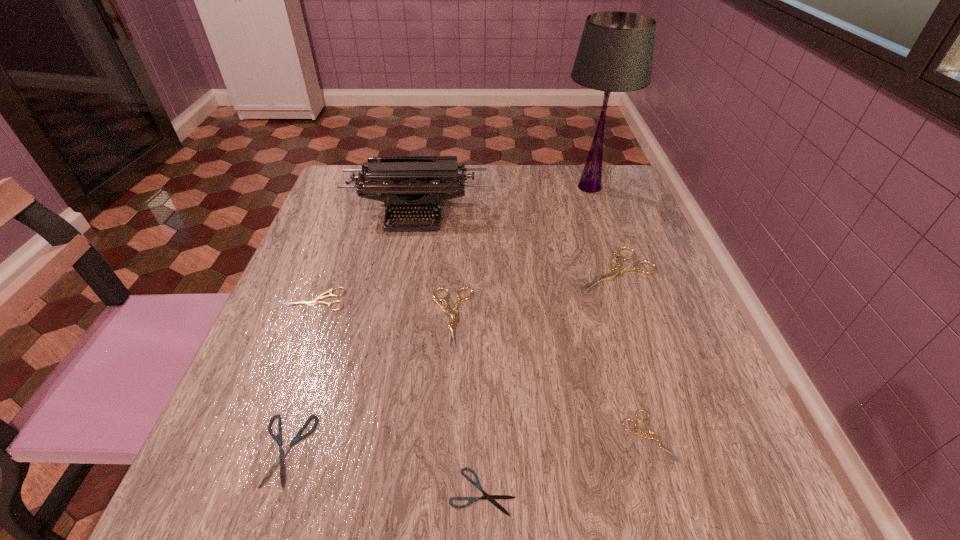
In the image, there is a desktop. Identify the location of vacant region at the left edge. This screenshot has height=540, width=960. (323, 428).

The height and width of the screenshot is (540, 960). What are the coordinates of `vacant space at the right edge of the desktop` in the screenshot? It's located at (660, 328).

You are a GUI agent. You are given a task and a screenshot of the screen. Output one action in this format:
    pyautogui.click(x=<x>, y=<y>)
    Task: Click on the free area in between the bigger black shears and the fourth shortest object
    The image size is (960, 540).
    Given the screenshot: What is the action you would take?
    pyautogui.click(x=300, y=375)

Locate an element on the screen. The image size is (960, 540). blank region between the second biggest beige shears and the tallest shears is located at coordinates (534, 293).

Where is `blank region between the smallest beige shears and the second tallest shears`? Image resolution: width=960 pixels, height=540 pixels. blank region between the smallest beige shears and the second tallest shears is located at coordinates (550, 376).

This screenshot has height=540, width=960. In order to click on vacant area that lies between the leftmost beige shears and the nearest beige shears in this screenshot , I will do `click(482, 368)`.

Identify the location of free space between the sixth shortest object and the third beige shears from right to left. (534, 293).

This screenshot has width=960, height=540. Find the location of `empty location between the smallest beige shears and the fifth tallest object`. empty location between the smallest beige shears and the fifth tallest object is located at coordinates (482, 368).

I want to click on free point between the second beige shears from left to right and the tallest object, so click(x=520, y=252).

Image resolution: width=960 pixels, height=540 pixels. I want to click on vacant region between the smaller black shears and the bigger black shears, so click(x=384, y=471).